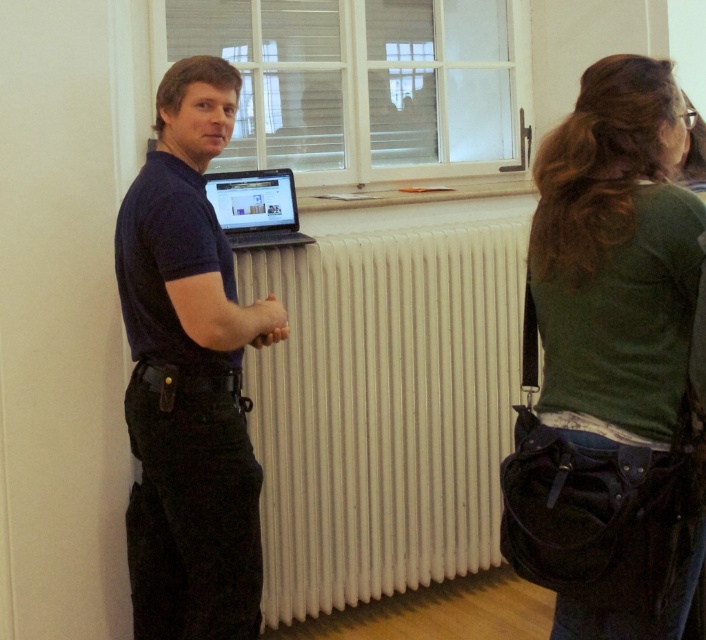
Question: Which of these objects is positioned farthest from the matte black laptop at center?

Choices:
 (A) green fabric shirt at upper right
 (B) white ribbed radiator at center

Answer: (A)

Question: Considering the relative positions of green fabric shirt at upper right and matte black laptop at center in the image provided, where is green fabric shirt at upper right located with respect to matte black laptop at center?

Choices:
 (A) left
 (B) right

Answer: (B)

Question: Which point is farther to the camera?

Choices:
 (A) dark blue shirt at center
 (B) matte black laptop at center
 (C) green fabric shirt at upper right
 (D) white ribbed radiator at center

Answer: (D)

Question: Is green fabric shirt at upper right closer to the viewer compared to dark blue shirt at center?

Choices:
 (A) no
 (B) yes

Answer: (B)

Question: Estimate the real-world distances between objects in this image. Which object is farther from the dark blue shirt at center?

Choices:
 (A) white ribbed radiator at center
 (B) matte black laptop at center

Answer: (A)

Question: Is dark blue shirt at center below matte black laptop at center?

Choices:
 (A) no
 (B) yes

Answer: (B)